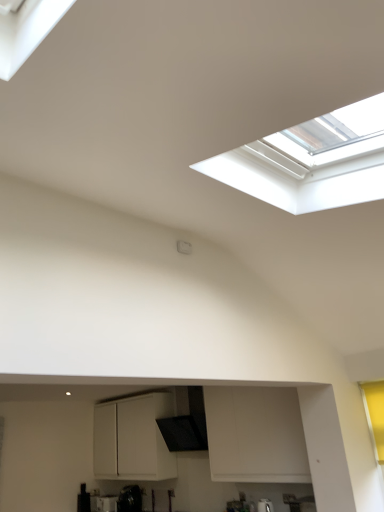
Question: From a real-world perspective, is white matte cabinet at center above or below black glossy kettle at lower center?

Choices:
 (A) below
 (B) above

Answer: (B)

Question: Based on their sizes in the image, would you say white matte cabinet at center is bigger or smaller than black glossy kettle at lower center?

Choices:
 (A) small
 (B) big

Answer: (B)

Question: Which object is positioned farthest from the black textured exhaust hood at center?

Choices:
 (A) black glossy kettle at lower center
 (B) white matte cabinet at center

Answer: (A)

Question: Based on their relative distances, which object is farther from the white matte cabinet at center?

Choices:
 (A) black glossy kettle at lower center
 (B) black textured exhaust hood at center

Answer: (A)